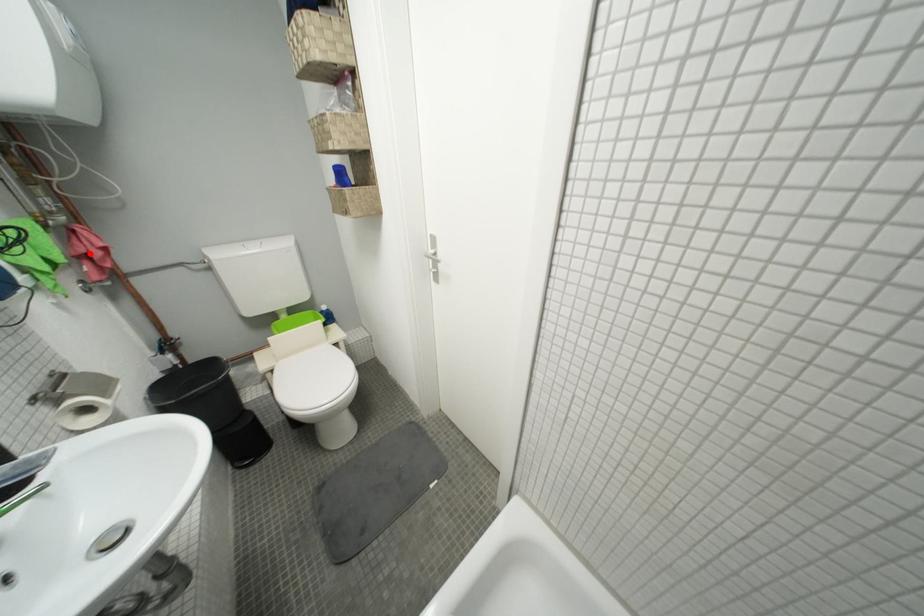
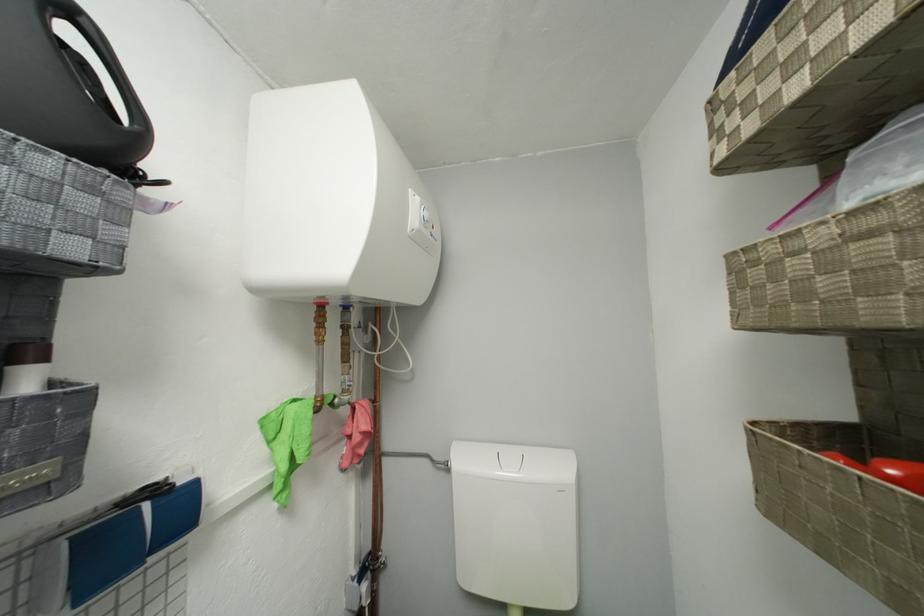
In the second image, find the point that corresponds to the highlighted location in the first image.

(358, 435)